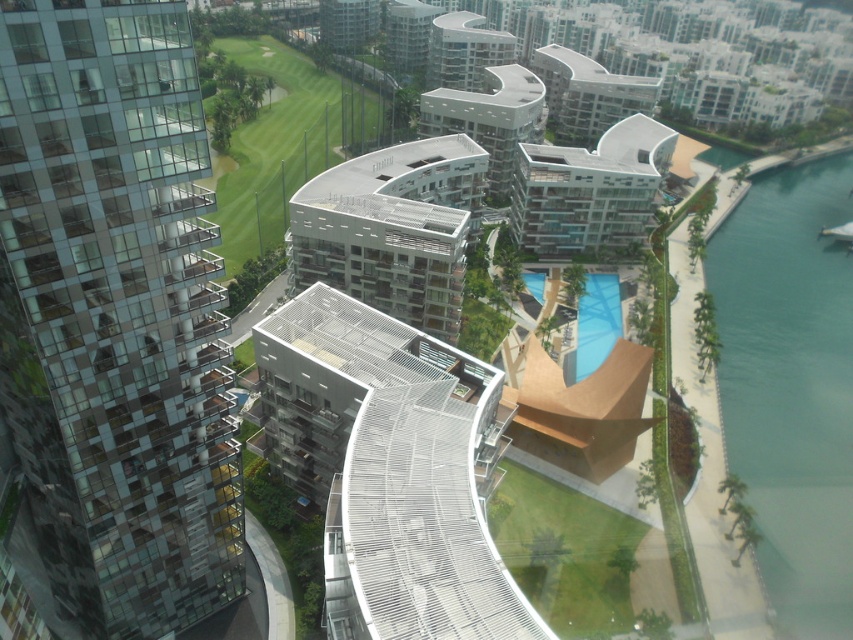
Looking at this image, who is more distant from viewer, (88, 420) or (258, 209)?

Point (258, 209)

Does glassy reflective building at left have a larger size compared to green grass at center?

No, glassy reflective building at left is not bigger than green grass at center.

This screenshot has width=853, height=640. In order to click on glassy reflective building at left in this screenshot , I will do `click(115, 314)`.

Does point (45, 104) lie in front of point (517, 500)?

That is True.

Between point (59, 177) and point (613, 557), which one is positioned behind?

Positioned behind is point (613, 557).

The width and height of the screenshot is (853, 640). What do you see at coordinates (115, 314) in the screenshot?
I see `glassy reflective building at left` at bounding box center [115, 314].

I want to click on glassy reflective building at left, so click(115, 314).

Does green grass at center come in front of green grass at lower center?

No, it is not.

Does point (326, 76) lie behind point (631, 605)?

That is True.

This screenshot has width=853, height=640. Describe the element at coordinates (282, 144) in the screenshot. I see `green grass at center` at that location.

You are a GUI agent. You are given a task and a screenshot of the screen. Output one action in this format:
    pyautogui.click(x=<x>, y=<y>)
    Task: Click on the green grass at center
    
    Given the screenshot: What is the action you would take?
    pyautogui.click(x=282, y=144)